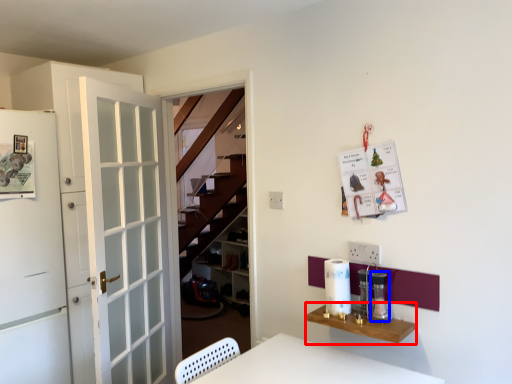
Question: Among these objects, which one is farthest to the camera, table (highlighted by a red box) or appliance (highlighted by a blue box)?

Choices:
 (A) table
 (B) appliance

Answer: (B)